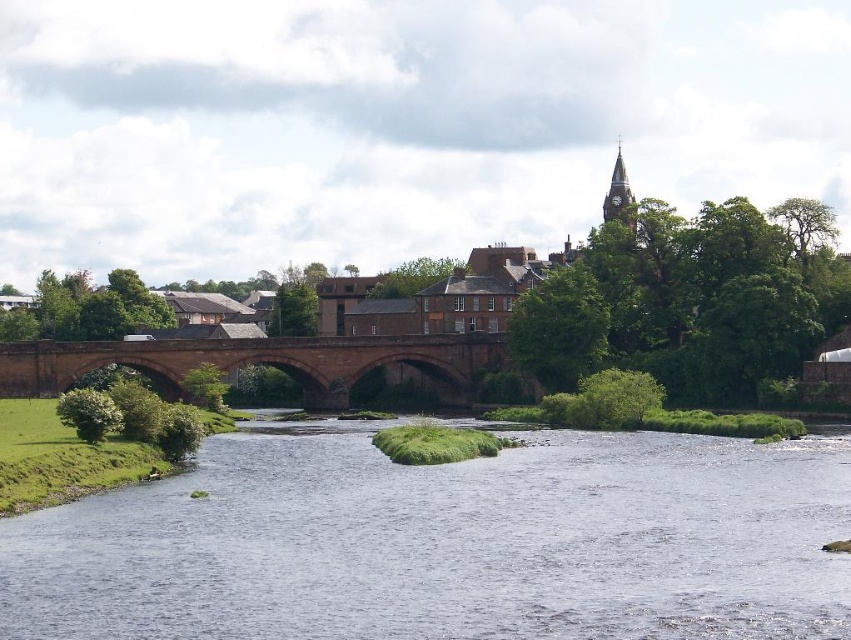
You are standing at point (x=447, y=541) in the riverside scene. What do you see directly beneath your feet?

You see clear water at center directly beneath your feet at point (x=447, y=541).

You are a tourist standing on the riverside path and want to take a photo of the clear water at center and the matte stone bridge at center. Which object should you focus on first if you want to capture both in one frame without moving the camera?

You should focus on the matte stone bridge at center first because it occupies more space than the clear water at center, ensuring it is properly framed before adjusting for the smaller area of clear water at center.